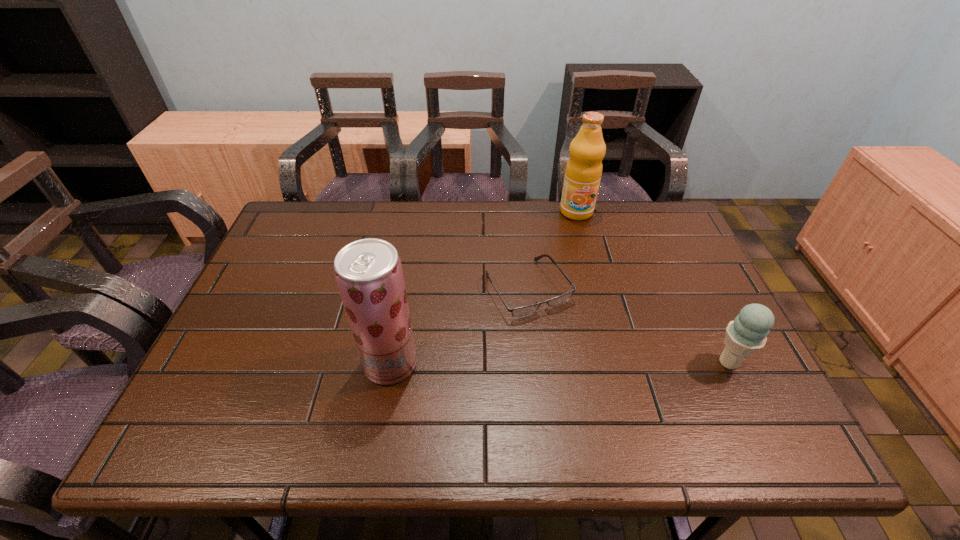
Image resolution: width=960 pixels, height=540 pixels. Find the location of `free spot on the desktop that is between the nearer fruit juice and the third tallest object and is positioned on the front label of the right fruit juice`. free spot on the desktop that is between the nearer fruit juice and the third tallest object and is positioned on the front label of the right fruit juice is located at coordinates (609, 363).

What are the coordinates of `vacant spot on the desktop that is between the left fruit juice and the second shortest object and is positioned on the front-facing side of the second object from left to right` in the screenshot? It's located at (581, 363).